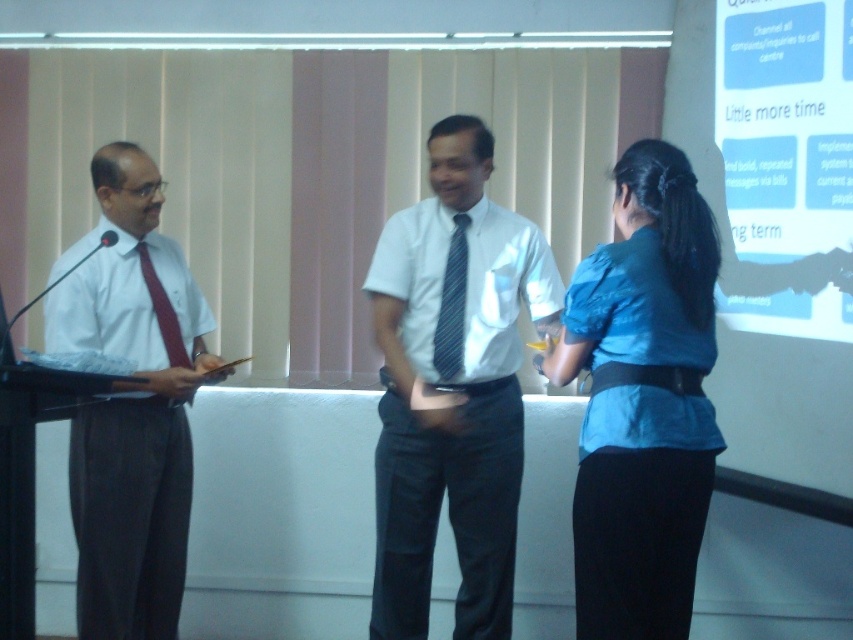
Does point (474, 256) come farther from viewer compared to point (138, 154)?

Yes, point (474, 256) is farther from viewer.

Is white glossy shirt at center to the left of matte white shirt at left from the viewer's perspective?

Incorrect, white glossy shirt at center is not on the left side of matte white shirt at left.

At what (x,y) coordinates should I click in order to perform the action: click on white glossy shirt at center. Please return your answer as a coordinate pair (x, y). Looking at the image, I should click on (451, 387).

Is blue satin blouse at right positioned at the back of blue striped tie at center?

No, it is in front of blue striped tie at center.

Between blue satin blouse at right and blue striped tie at center, which one is positioned lower?

blue satin blouse at right is below.

Which is in front, point (573, 493) or point (454, 280)?

Point (573, 493)

This screenshot has width=853, height=640. Find the location of `blue satin blouse at right`. blue satin blouse at right is located at coordinates (642, 401).

Is white glossy shirt at center smaller than white glossy projection screen at upper right?

Actually, white glossy shirt at center might be larger than white glossy projection screen at upper right.

Measure the distance between white glossy shirt at center and camera.

white glossy shirt at center and camera are 3.12 meters apart from each other.

Find the location of a particular element. This screenshot has width=853, height=640. white glossy shirt at center is located at coordinates (451, 387).

The image size is (853, 640). What are the coordinates of `white glossy shirt at center` in the screenshot? It's located at (451, 387).